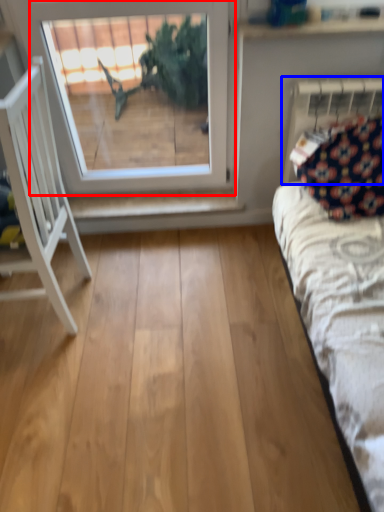
Question: Which object is closer to the camera taking this photo, window (highlighted by a red box) or radiator (highlighted by a blue box)?

Choices:
 (A) window
 (B) radiator

Answer: (A)